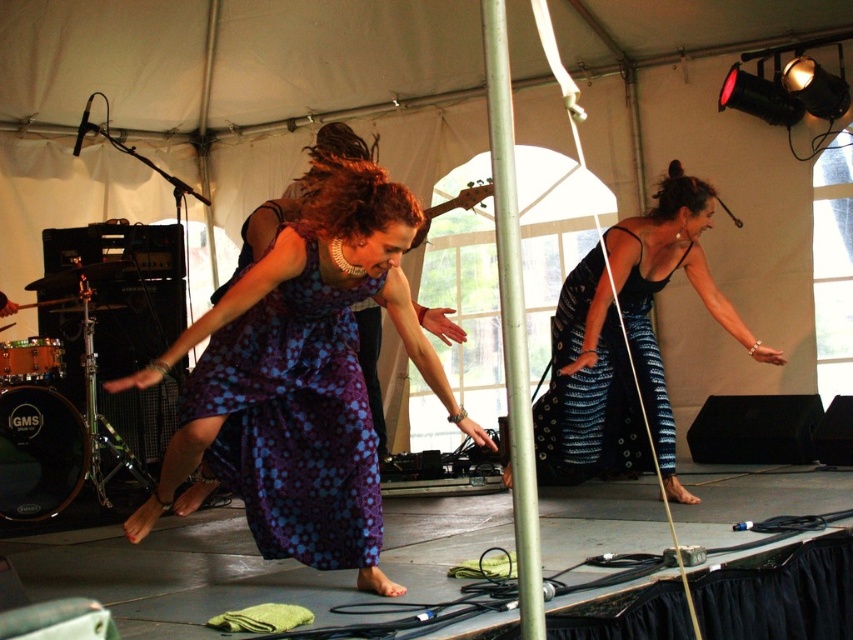
This screenshot has height=640, width=853. Describe the element at coordinates (294, 419) in the screenshot. I see `purple dotted fabric dress at center` at that location.

Does point (276, 490) lie behind point (457, 413)?

No, it is in front of (457, 413).

Is point (253, 529) less distant than point (456, 416)?

Yes.

Locate an element on the screen. purple dotted fabric dress at center is located at coordinates coord(294,419).

Consider the image. Can you confirm if blue dotted dress at center is taller than metallic silver bracelet at upper center?

Correct, blue dotted dress at center is much taller as metallic silver bracelet at upper center.

Does blue dotted dress at center have a lesser height compared to metallic silver bracelet at upper center?

No.

Which is behind, point (459, 413) or point (758, 346)?

Positioned behind is point (758, 346).

This screenshot has height=640, width=853. I want to click on blue dotted dress at center, so click(457, 416).

Does point (242, 429) come farther from viewer compared to point (587, 289)?

No, it is not.

Can you confirm if purple dotted fabric dress at center is shorter than black textured dress at right?

Yes.

I want to click on purple dotted fabric dress at center, so click(x=294, y=419).